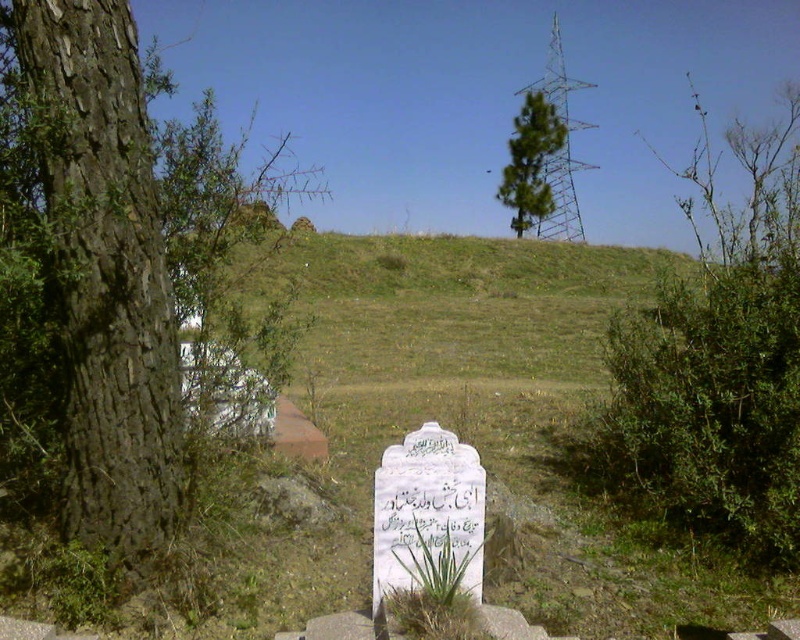
You are standing at the camera position looking at the scene. There is a point marked at coordinates point (754, 392). Can you tell me how far this point is from where you are standing?

The point (754, 392) is 11.95 feet away from the camera position.

You are standing at the base of the brown rough bark tree at left and want to walk to the green leafy tree at upper center. Which direction should you face to move towards it?

You should face towards the upper center direction to walk towards the green leafy tree at upper center, as the brown rough bark tree at left is in front of it, meaning the green leafy tree is behind the brown rough bark tree at left.

Looking at this image, you are standing at the base of the brown rough bark tree at left and want to walk to the green leafy tree at upper center. Which direction should you move to reach it?

The brown rough bark tree at left is below the green leafy tree at upper center, so you should move upward to reach it.